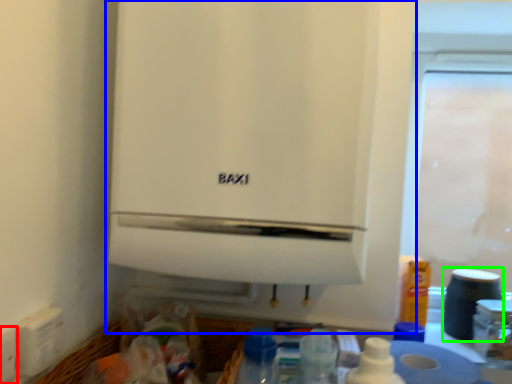
Question: Which object is positioned closest to electric outlet (highlighted by a red box)? Select from home appliance (highlighted by a blue box) and appliance (highlighted by a green box).

Choices:
 (A) home appliance
 (B) appliance

Answer: (A)